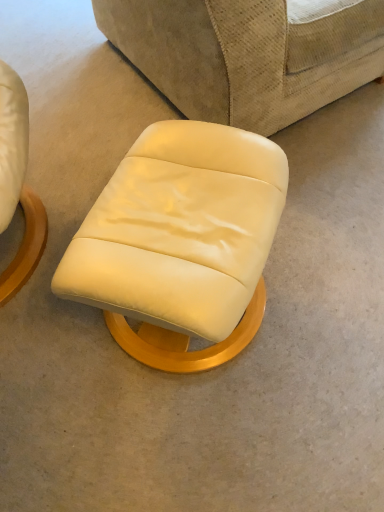
Image resolution: width=384 pixels, height=512 pixels. In order to click on vacant space situated on the left part of matte cream leather ottoman at center in this screenshot , I will do `click(44, 316)`.